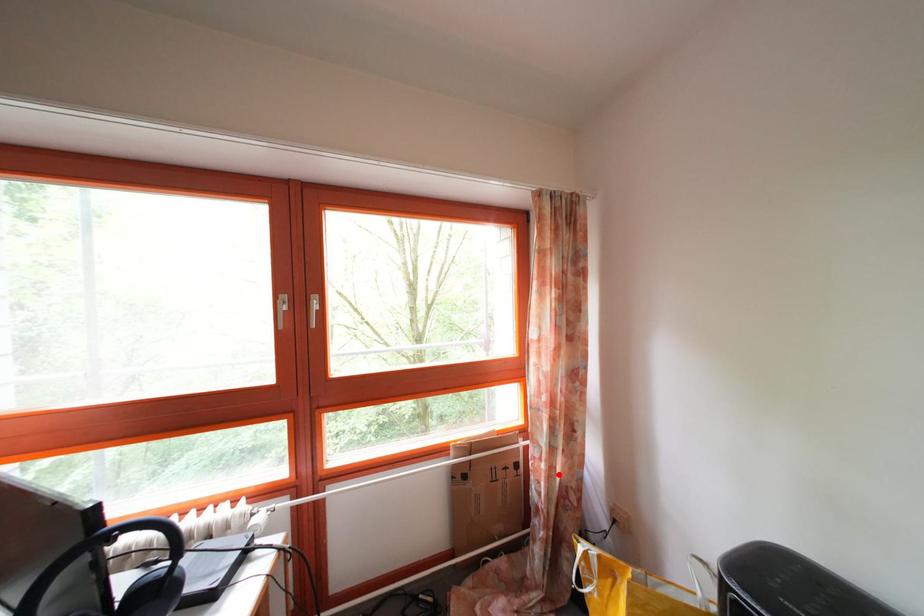
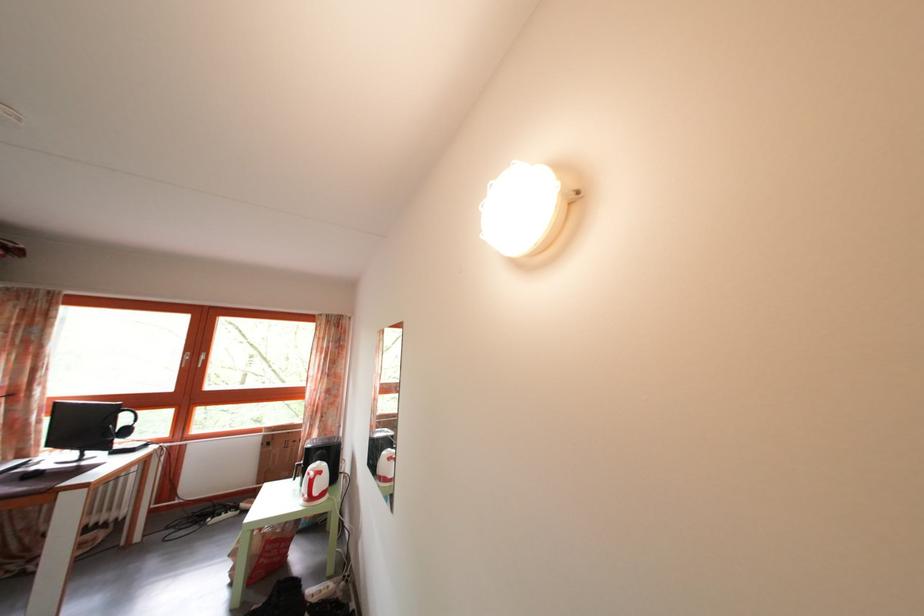
Question: I am providing you with two images of the same scene from different viewpoints. Image1 has a red point marked. In image2, the corresponding 3D location appears at what relative position? Reply with the corresponding letter.

Choices:
 (A) Closer
 (B) Farther

Answer: (A)